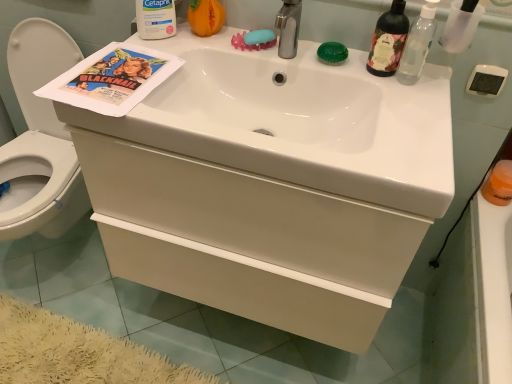
The width and height of the screenshot is (512, 384). Identify the location of free space to the left of green translucent soap at upper center, the second soap viewed from the left. 283,53.